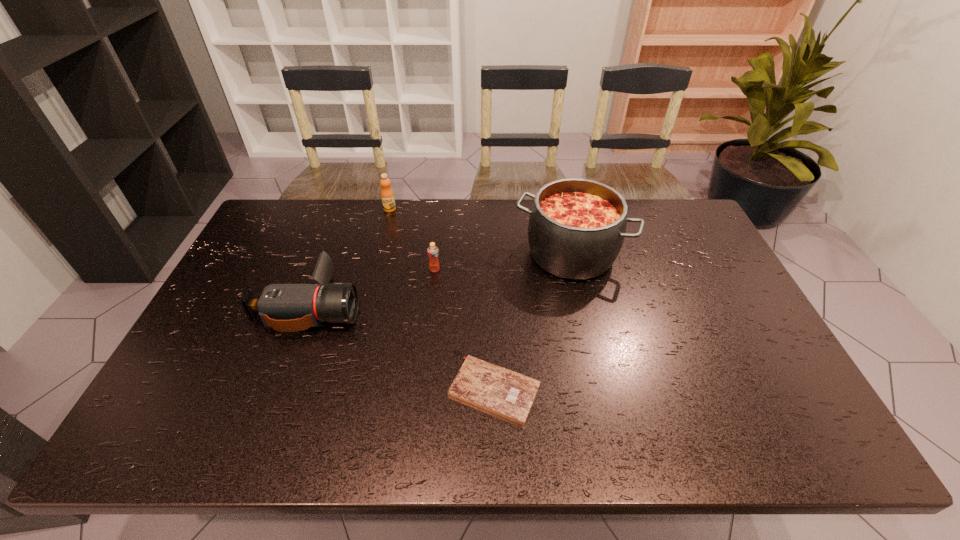
Where is `vacant space at the right edge of the desktop`? vacant space at the right edge of the desktop is located at coordinates (668, 246).

Locate an element on the screen. The width and height of the screenshot is (960, 540). vacant space at the far right corner of the desktop is located at coordinates (660, 200).

This screenshot has width=960, height=540. I want to click on vacant area that lies between the camcorder and the right orange juice, so click(x=372, y=287).

Where is `empty space that is in between the third object from right to left and the tallest object`? The width and height of the screenshot is (960, 540). empty space that is in between the third object from right to left and the tallest object is located at coordinates (503, 261).

Where is `vacant space that is in between the tallest object and the farther orange juice`? The width and height of the screenshot is (960, 540). vacant space that is in between the tallest object and the farther orange juice is located at coordinates (481, 231).

You are a GUI agent. You are given a task and a screenshot of the screen. Output one action in this format:
    pyautogui.click(x=<x>, y=<y>)
    Task: Click on the free space that is in between the right orange juice and the casserole
    Image resolution: width=960 pixels, height=540 pixels.
    Given the screenshot: What is the action you would take?
    pyautogui.click(x=503, y=261)

Locate an element on the screen. Image resolution: width=960 pixels, height=540 pixels. free space between the camcorder and the farther orange juice is located at coordinates (350, 257).

Identify the location of free area in between the shortest object and the right orange juice. (465, 330).

I want to click on free space between the shortest object and the camcorder, so click(402, 348).

This screenshot has width=960, height=540. I want to click on free space between the shorter orange juice and the tallest object, so click(503, 261).